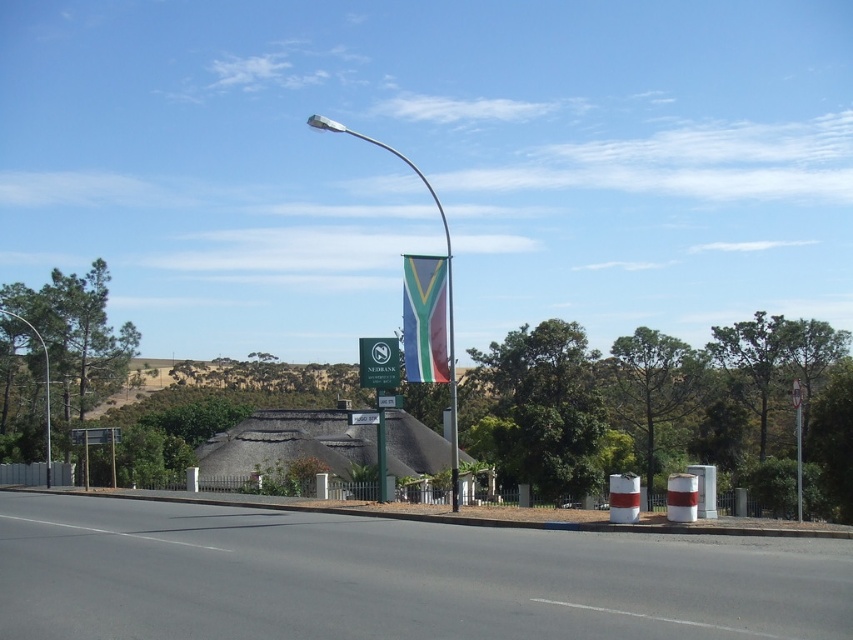
Question: Estimate the real-world distances between objects in this image. Which object is farther from the green plastic sign at center?

Choices:
 (A) white plastic sign at center
 (B) polyester flag at center
 (C) green plastic street sign at center

Answer: (C)

Question: Estimate the real-world distances between objects in this image. Which object is farther from the metallic pole at left?

Choices:
 (A) green plastic street sign at center
 (B) polyester flag at center

Answer: (A)

Question: Considering the real-world distances, which object is farthest from the metallic pole at left?

Choices:
 (A) metallic pole at center
 (B) green plastic sign at center

Answer: (A)

Question: Where is metallic pole at left located in relation to white plastic sign at center in the image?

Choices:
 (A) above
 (B) below

Answer: (B)

Question: Can you confirm if green plastic sign at center is positioned to the left of green plastic street sign at center?

Choices:
 (A) yes
 (B) no

Answer: (A)

Question: Is metallic pole at center above metallic pole at left?

Choices:
 (A) yes
 (B) no

Answer: (A)